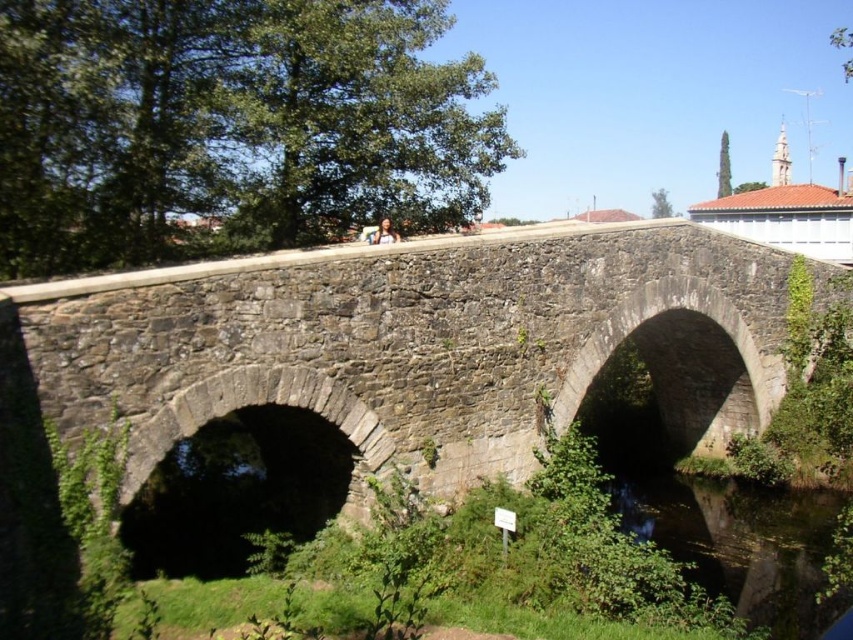
Which is in front, point (358, 400) or point (799, 506)?

Positioned in front is point (358, 400).

Who is more distant from viewer, [520,323] or [786,509]?

Positioned behind is point [786,509].

You are a GUI agent. You are given a task and a screenshot of the screen. Output one action in this format:
    pyautogui.click(x=<x>, y=<y>)
    Task: Click on the gray stone bridge at center
    This screenshot has width=853, height=640.
    Given the screenshot: What is the action you would take?
    pyautogui.click(x=421, y=342)